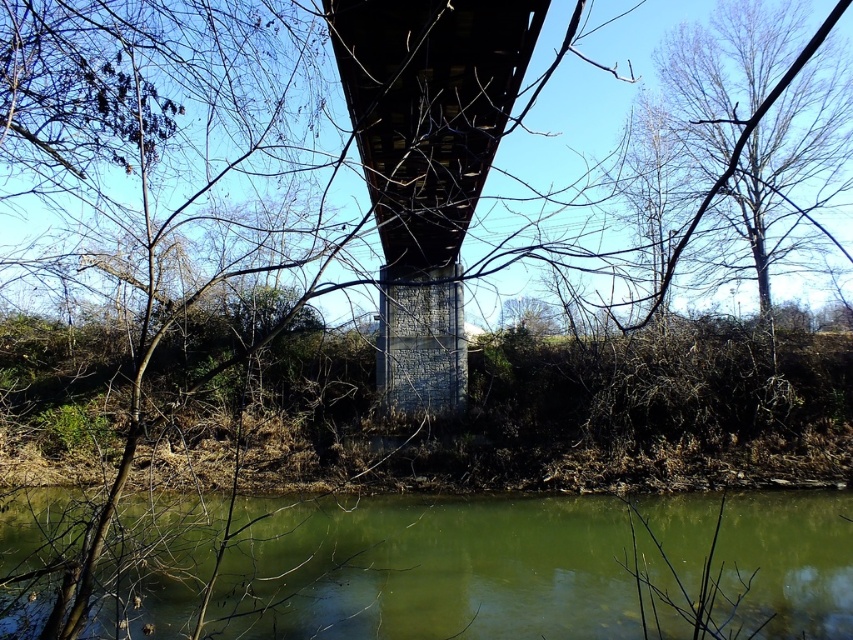
Who is positioned more to the right, green murky water at lower center or concrete bridge at center?

From the viewer's perspective, green murky water at lower center appears more on the right side.

Does green murky water at lower center appear under concrete bridge at center?

Yes.

Is point (833, 548) more distant than point (500, 28)?

Yes, it is behind point (500, 28).

Where is `green murky water at lower center`? The width and height of the screenshot is (853, 640). green murky water at lower center is located at coordinates [x=438, y=570].